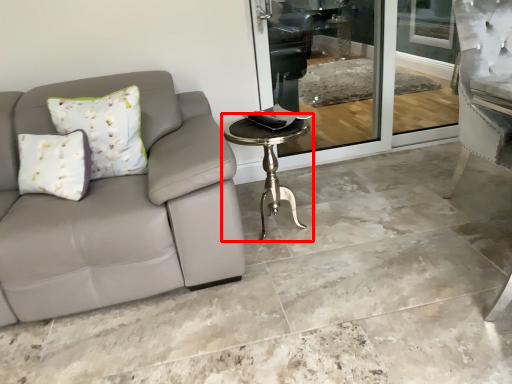
Question: Where is table (annotated by the red box) located in relation to concrete in the image?

Choices:
 (A) right
 (B) left

Answer: (B)